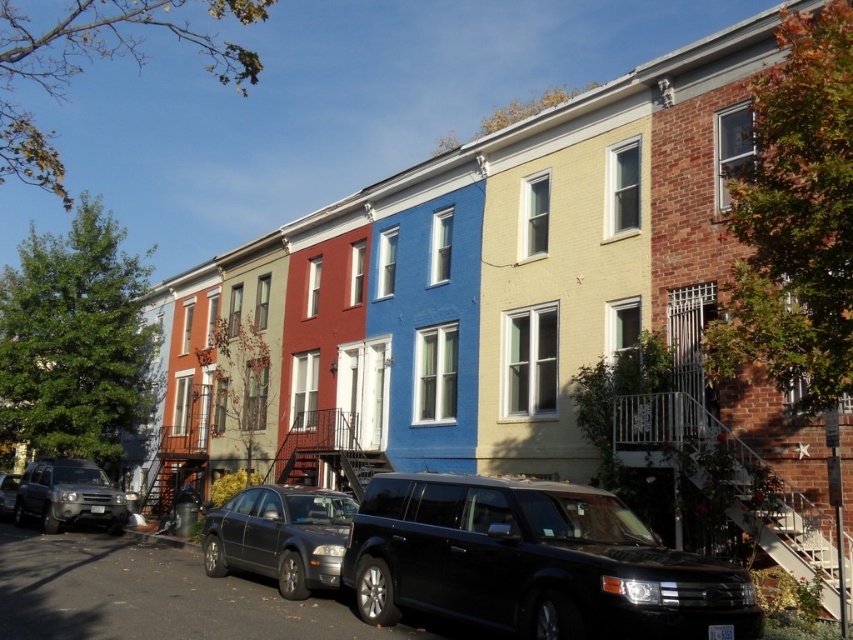
Question: Is silver metallic suv at lower left closer to camera compared to matte silver suv at lower left?

Choices:
 (A) yes
 (B) no

Answer: (A)

Question: Which object appears closest to the camera in this image?

Choices:
 (A) metallic gray sedan at center
 (B) shiny black suv at center
 (C) matte silver suv at lower left
 (D) silver metallic suv at lower left

Answer: (B)

Question: Which point is closer to the camera taking this photo?

Choices:
 (A) (553, 545)
 (B) (25, 499)

Answer: (A)

Question: Does shiny black suv at center have a smaller size compared to silver metallic suv at lower left?

Choices:
 (A) yes
 (B) no

Answer: (B)

Question: Based on their relative distances, which object is farther from the shiny black suv at center?

Choices:
 (A) metallic gray sedan at center
 (B) matte silver suv at lower left
 (C) silver metallic suv at lower left

Answer: (B)

Question: Can you confirm if shiny black suv at center is positioned below matte silver suv at lower left?

Choices:
 (A) no
 (B) yes

Answer: (A)